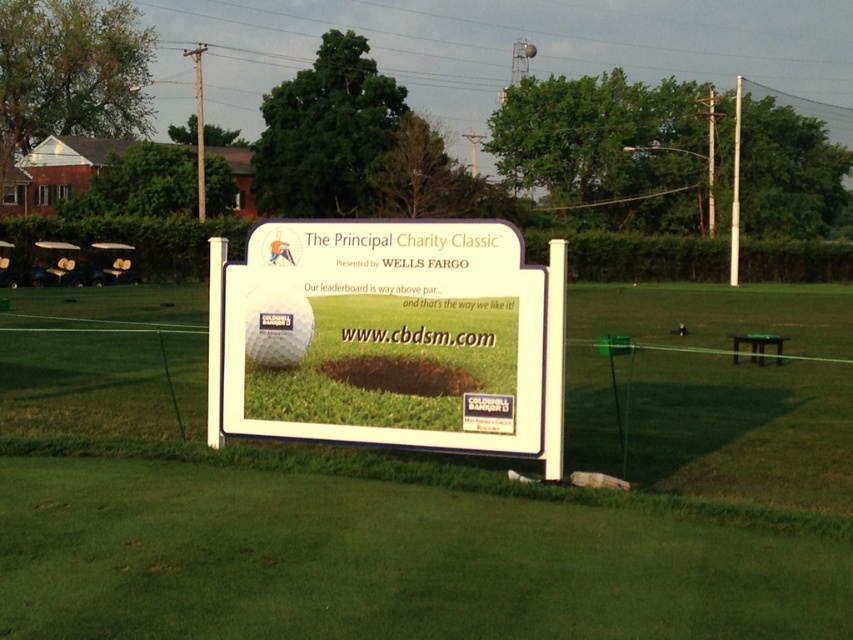
What is the exact coordinate of the white matte sign at center?

The white matte sign at center is located at point [403,506].

You are a golfer standing at the tee box and see the white matte sign at center and the white plastic sign at center. Which one is positioned lower in the scene?

The white matte sign at center is positioned below the white plastic sign at center, so it is lower in the scene.

You are standing at the golf course and see two points marked on the signboard. The first point is at coordinates point (201, 410) and the second is at point (329, 436). Which point is closer to you?

Point (201, 410) is behind point (329, 436), so the point closer to you is point (329, 436).